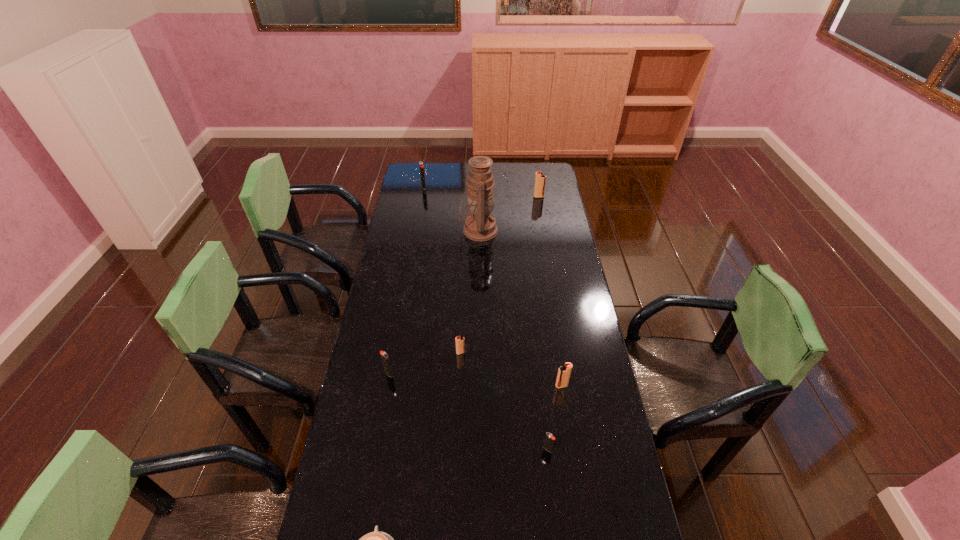
At what (x,y) coordinates should I click in order to perform the action: click on empty space that is in between the rightmost black igniter and the biggest red igniter. Please return your answer as a coordinate pair (x, y). Image resolution: width=960 pixels, height=540 pixels. Looking at the image, I should click on (543, 323).

Locate an element on the screen. The image size is (960, 540). unoccupied position between the oil lamp and the farthest black igniter is located at coordinates (451, 209).

At what (x,y) coordinates should I click in order to perform the action: click on object that stands as the fifth closest to the rightmost black igniter. Please return your answer as a coordinate pair (x, y). The width and height of the screenshot is (960, 540). Looking at the image, I should click on (479, 226).

Image resolution: width=960 pixels, height=540 pixels. In order to click on object that is the closest to the rightmost black igniter in this screenshot , I will do `click(564, 372)`.

Locate an element on the screen. igniter that stands as the fourth closest to the second nearest red igniter is located at coordinates (540, 179).

Identify the location of igniter that is the fourth closest one to the nearest black igniter. This screenshot has height=540, width=960. (540, 179).

Locate which red igniter ranks in proximity to the farthest object. Please provide its 2D coordinates. Your answer should be formatted as a tuple, i.e. [(x, y)], where the tuple contains the x and y coordinates of a point satisfying the conditions above.

[(540, 179)]

Identify which red igniter is located as the second nearest to the fifth farthest igniter. Please provide its 2D coordinates. Your answer should be formatted as a tuple, i.e. [(x, y)], where the tuple contains the x and y coordinates of a point satisfying the conditions above.

[(540, 179)]

The height and width of the screenshot is (540, 960). Find the location of `black igniter that is the third closest to the second smallest red igniter`. black igniter that is the third closest to the second smallest red igniter is located at coordinates (421, 165).

At what (x,y) coordinates should I click in order to perform the action: click on black igniter that is the second closest to the third nearest object. Please return your answer as a coordinate pair (x, y). The image size is (960, 540). Looking at the image, I should click on (385, 360).